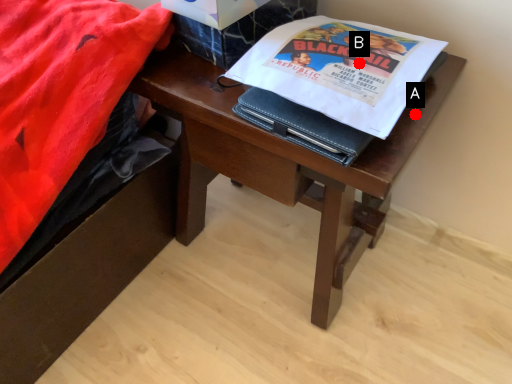
Question: Two points are circled on the image, labeled by A and B beside each circle. Which of the following is the farthest from the observer?

Choices:
 (A) A is further
 (B) B is further

Answer: (A)